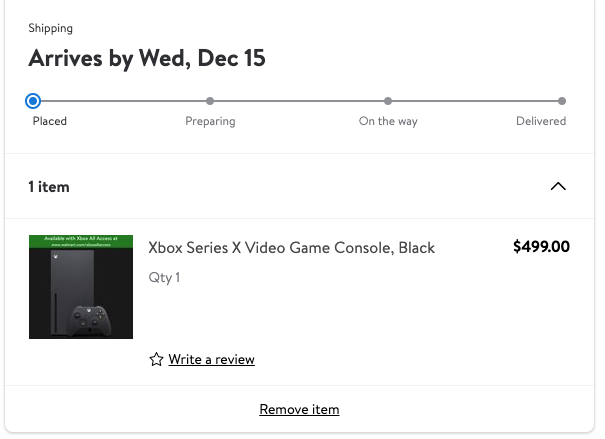
In order to click on gaming controller in this screenshot , I will do `click(89, 317)`.